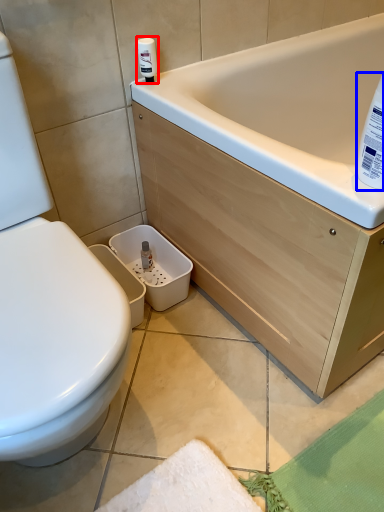
Question: Which object is further to the camera taking this photo, cleaning product (highlighted by a red box) or cleaning product (highlighted by a blue box)?

Choices:
 (A) cleaning product
 (B) cleaning product

Answer: (A)